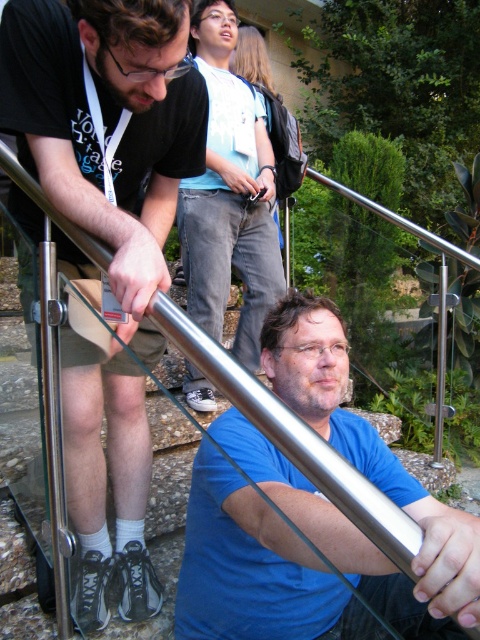
Is point (132, 593) farther from viewer compared to point (312, 516)?

Yes, it is behind point (312, 516).

Is point (157, 188) closer to viewer compared to point (235, 516)?

No, it is not.

Describe the element at coordinates (108, 128) in the screenshot. The width and height of the screenshot is (480, 640). I see `matte black shirt at center` at that location.

Find the location of a particular element. The image size is (480, 640). matte black shirt at center is located at coordinates (108, 128).